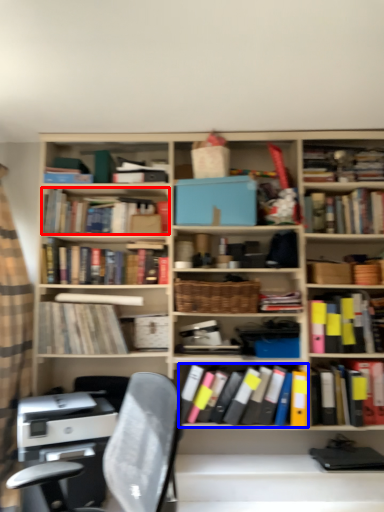
Question: Which object appears farthest to the camera in this image, book (highlighted by a red box) or book (highlighted by a blue box)?

Choices:
 (A) book
 (B) book

Answer: (A)